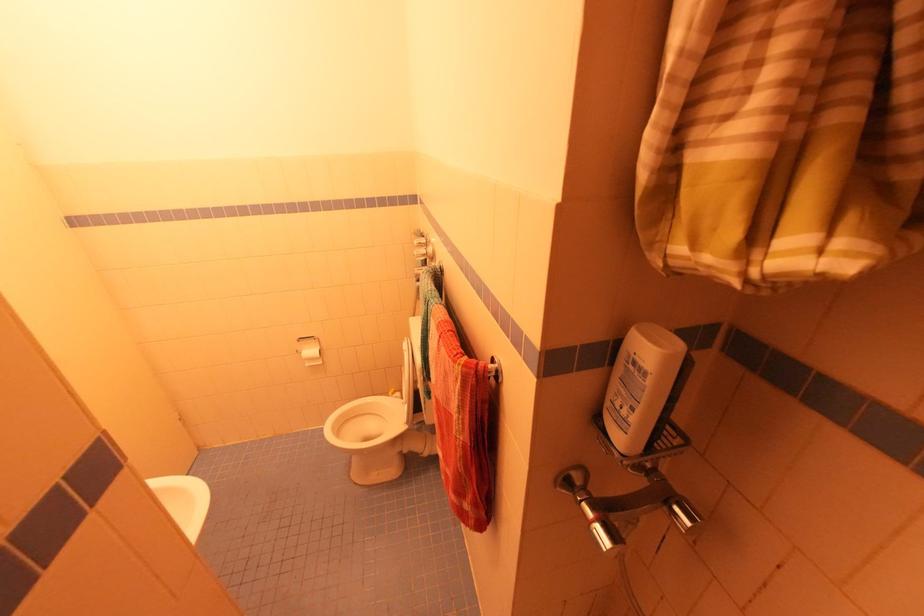
This screenshot has height=616, width=924. I want to click on toilet paper roll, so (310, 350).